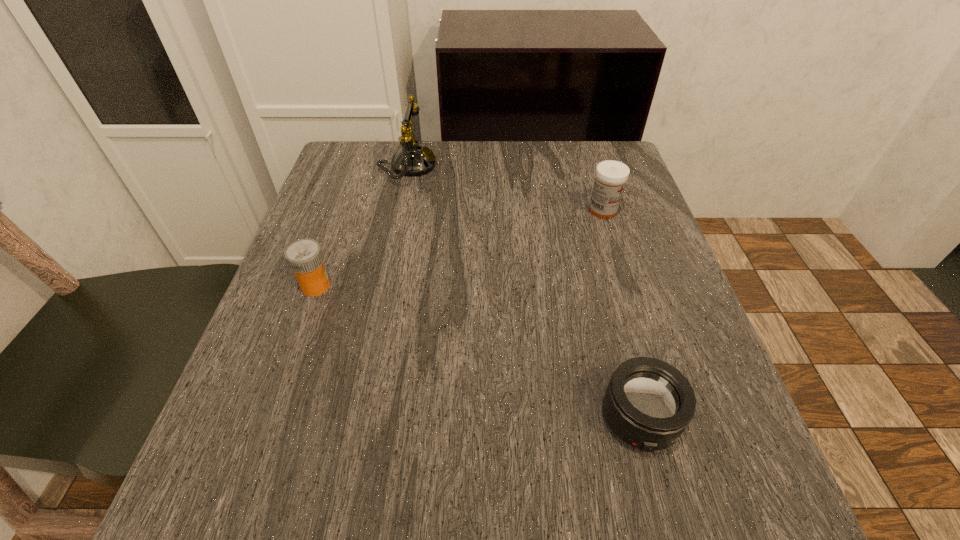
What are the coordinates of `free space between the third shortest object and the telephone` in the screenshot? It's located at (505, 188).

This screenshot has width=960, height=540. What are the coordinates of `vacant area that lies between the third farthest object and the telephone` in the screenshot? It's located at (362, 226).

Find the location of a particular element. The height and width of the screenshot is (540, 960). free point between the telephone and the shortest object is located at coordinates (523, 292).

Where is `free space between the second object from left to right and the second tallest object`? This screenshot has height=540, width=960. free space between the second object from left to right and the second tallest object is located at coordinates (505, 188).

Find the location of a particular element. This screenshot has height=540, width=960. vacant space that's between the telephoto lens and the third nearest object is located at coordinates (621, 314).

Identify which object is located as the nearest to the telephone. Please provide its 2D coordinates. Your answer should be formatted as a tuple, i.e. [(x, y)], where the tuple contains the x and y coordinates of a point satisfying the conditions above.

[(304, 257)]

Where is `the second closest object relative to the farthest object`? the second closest object relative to the farthest object is located at coordinates (611, 176).

Image resolution: width=960 pixels, height=540 pixels. Find the location of `free space that satisfies the following two spatial constraints: 1. on the dial of the taller medicine; 2. on the right side of the farthest object`. free space that satisfies the following two spatial constraints: 1. on the dial of the taller medicine; 2. on the right side of the farthest object is located at coordinates (398, 211).

Locate an element on the screen. The height and width of the screenshot is (540, 960). blank area in the image that satisfies the following two spatial constraints: 1. on the front side of the farther medicine; 2. on the label side of the third farthest object is located at coordinates (627, 286).

Locate an element on the screen. The image size is (960, 540). vacant space that satisfies the following two spatial constraints: 1. on the dial of the farther medicine; 2. on the right side of the telephone is located at coordinates (398, 211).